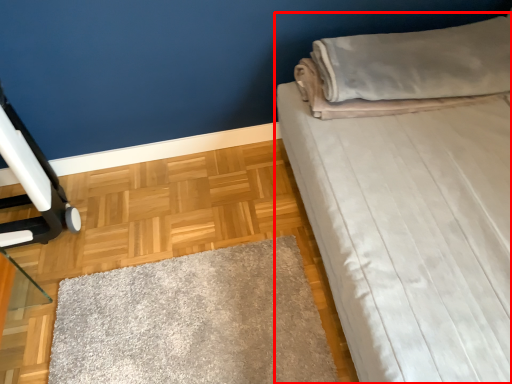
Question: From the image's perspective, considering the relative positions of bed (annotated by the red box) and pillow in the image provided, where is bed (annotated by the red box) located with respect to the staircase?

Choices:
 (A) above
 (B) below

Answer: (B)